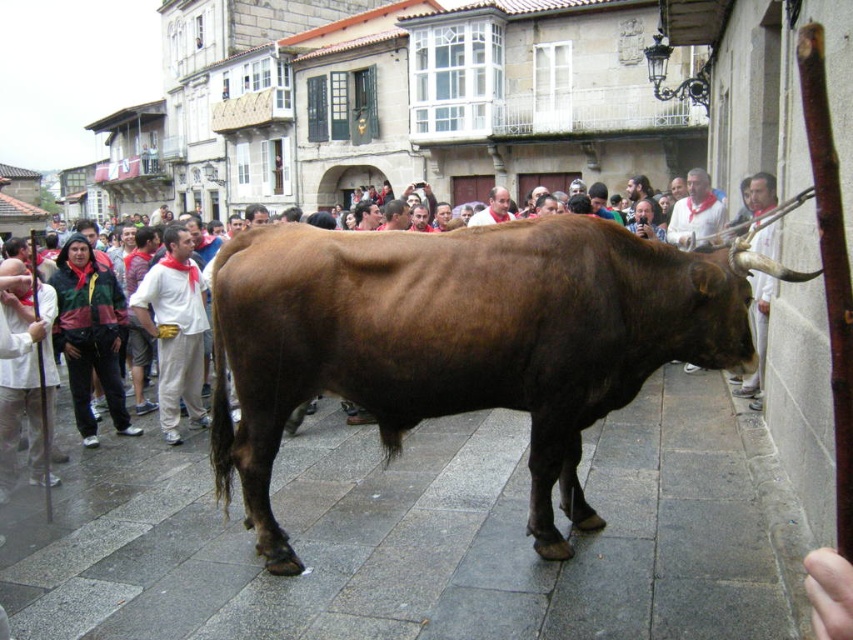
You are standing on the gray stone pavement at center and want to move to the area behind the brown glossy cow at center. Is the path clear for you to walk directly behind the cow?

The gray stone pavement at center is in front of the brown glossy cow at center, so the path behind the cow is clear for you to walk directly behind it.

You are standing at point (650, 337) and want to walk towards the bull in the center of the street. Is the point (642, 483) behind or in front of you relative to your direction?

Point (642, 483) is behind point (650, 337), so it is behind you relative to your direction towards the bull in the center of the street.